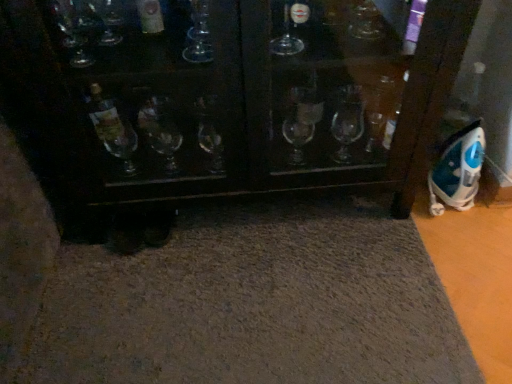
Question: Is gray carpet at lower center taller or shorter than blue plastic iron at right?

Choices:
 (A) short
 (B) tall

Answer: (A)

Question: In terms of size, does gray carpet at lower center appear bigger or smaller than blue plastic iron at right?

Choices:
 (A) small
 (B) big

Answer: (B)

Question: In the image, is gray carpet at lower center on the left side or the right side of blue plastic iron at right?

Choices:
 (A) left
 (B) right

Answer: (A)

Question: Considering the positions of blue plastic iron at right and gray carpet at lower center in the image, is blue plastic iron at right taller or shorter than gray carpet at lower center?

Choices:
 (A) tall
 (B) short

Answer: (A)

Question: Considering the positions of blue plastic iron at right and gray carpet at lower center in the image, is blue plastic iron at right wider or thinner than gray carpet at lower center?

Choices:
 (A) thin
 (B) wide

Answer: (A)

Question: In the image, is blue plastic iron at right on the left side or the right side of gray carpet at lower center?

Choices:
 (A) right
 (B) left

Answer: (A)

Question: Is blue plastic iron at right inside or outside of gray carpet at lower center?

Choices:
 (A) outside
 (B) inside

Answer: (A)